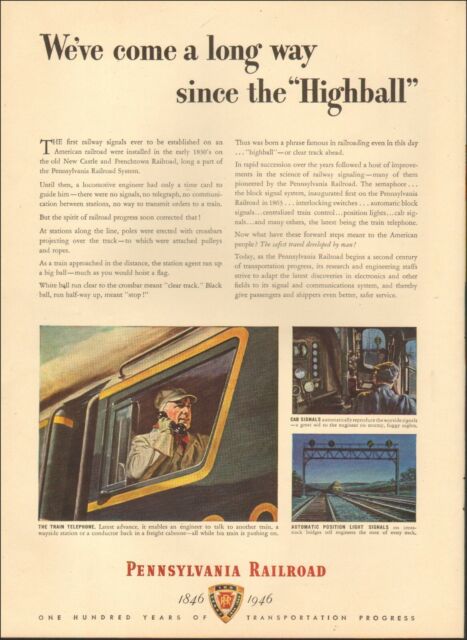
I want to click on photographs, so click(x=259, y=381), click(x=345, y=396), click(x=344, y=484).